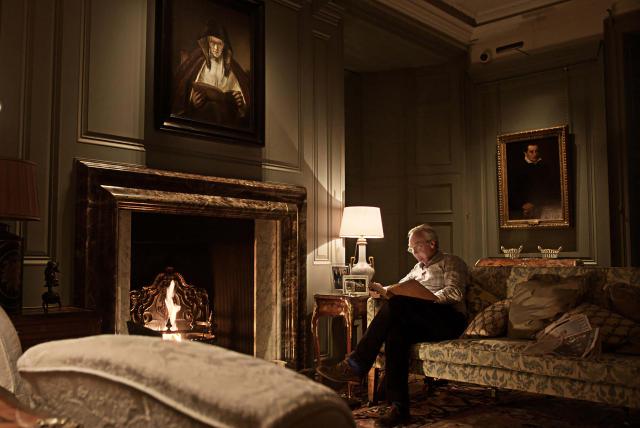
The image size is (640, 428). I want to click on book, so click(402, 287), click(378, 291).